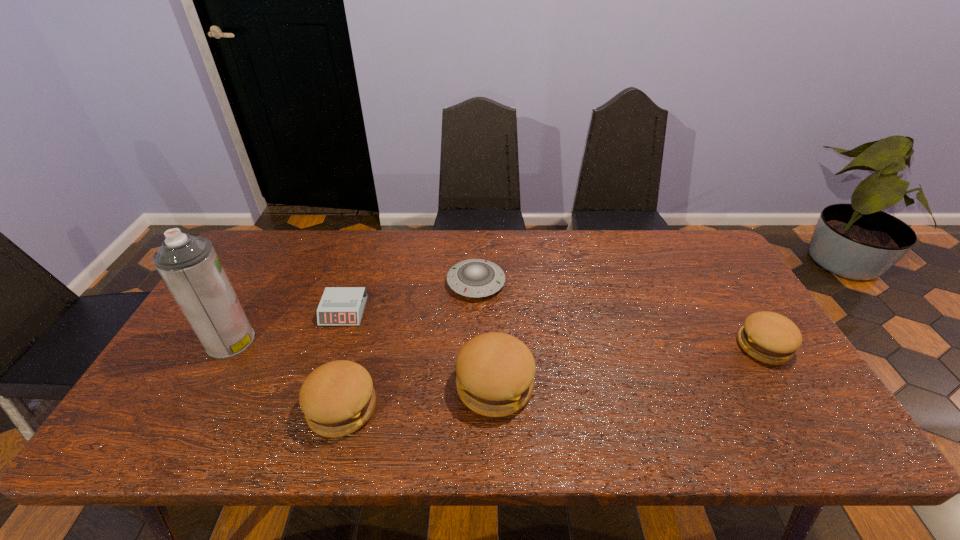
This screenshot has width=960, height=540. I want to click on object that stands as the fifth closest to the tallest object, so click(769, 337).

Identify which hamburger is the second nearest to the alarm clock. Please provide its 2D coordinates. Your answer should be formatted as a tuple, i.e. [(x, y)], where the tuple contains the x and y coordinates of a point satisfying the conditions above.

[(495, 371)]

Identify which hamburger is the nearest to the third shortest object. Please provide its 2D coordinates. Your answer should be formatted as a tuple, i.e. [(x, y)], where the tuple contains the x and y coordinates of a point satisfying the conditions above.

[(495, 371)]

Locate an element on the screen. vacant area that satisfies the following two spatial constraints: 1. on the back side of the saucer; 2. on the left side of the leftmost hamburger is located at coordinates (375, 282).

Locate an element on the screen. The height and width of the screenshot is (540, 960). free spot that satisfies the following two spatial constraints: 1. on the back side of the alarm clock; 2. on the right side of the saucer is located at coordinates (353, 282).